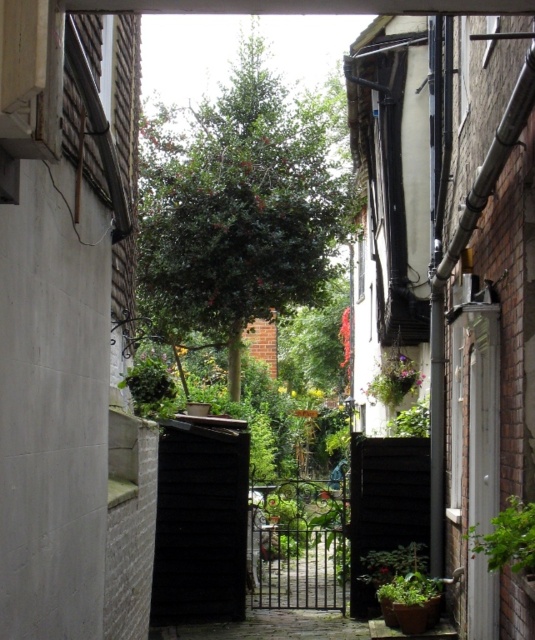
Is green leafy plant at right above green matte plant at center?

Yes.

This screenshot has width=535, height=640. Find the location of `green leafy plant at right`. green leafy plant at right is located at coordinates (508, 538).

Identify the location of green leafy plant at right. point(508,538).

At what (x,y) coordinates should I click in order to perform the action: click on green matte plant at lower right. Please return your answer as a coordinate pair (x, y). Image resolution: width=535 pixels, height=640 pixels. Looking at the image, I should click on (409, 589).

Does green matte plant at lower right appear on the left side of green leafy plant at center?

Correct, you'll find green matte plant at lower right to the left of green leafy plant at center.

Is point (428, 589) in front of point (387, 426)?

Yes, point (428, 589) is closer to viewer.

In order to click on green matte plant at lower right in this screenshot , I will do `click(409, 589)`.

Between green leafy plant at right and green matte plant at lower right, which one appears on the right side from the viewer's perspective?

green matte plant at lower right

Is point (511, 536) in front of point (377, 589)?

That is True.

Identify the location of green leafy plant at right. This screenshot has height=640, width=535. (508, 538).